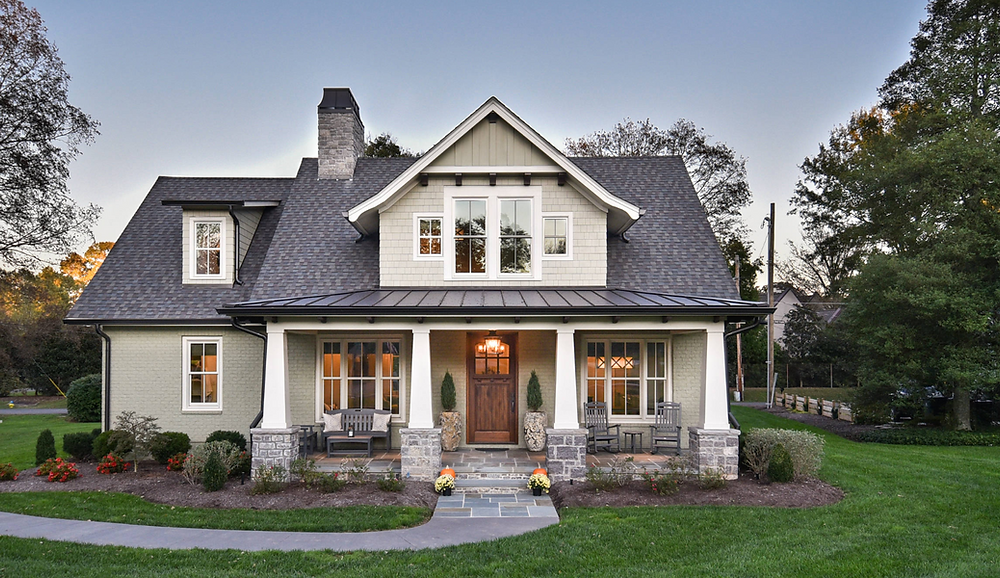
Find the location of a particular element. Image resolution: width=1000 pixels, height=578 pixels. pieces of gray furniture is located at coordinates (608, 429), (630, 442), (674, 425), (378, 413), (354, 452), (308, 429).